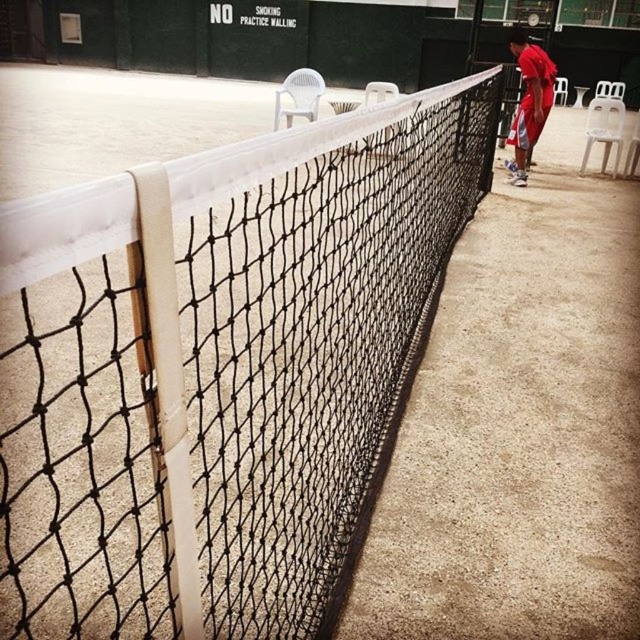
Question: Is the position of black mesh net at center more distant than that of red matte shirt at right?

Choices:
 (A) yes
 (B) no

Answer: (B)

Question: Does black mesh net at center have a greater width compared to red matte shirt at right?

Choices:
 (A) yes
 (B) no

Answer: (A)

Question: Which of the following is the farthest from the observer?

Choices:
 (A) (220, 432)
 (B) (541, 120)

Answer: (B)

Question: Observing the image, what is the correct spatial positioning of black mesh net at center in reference to red matte shirt at right?

Choices:
 (A) right
 (B) left

Answer: (B)

Question: Which object is farther from the camera taking this photo?

Choices:
 (A) red matte shirt at right
 (B) black mesh net at center

Answer: (A)